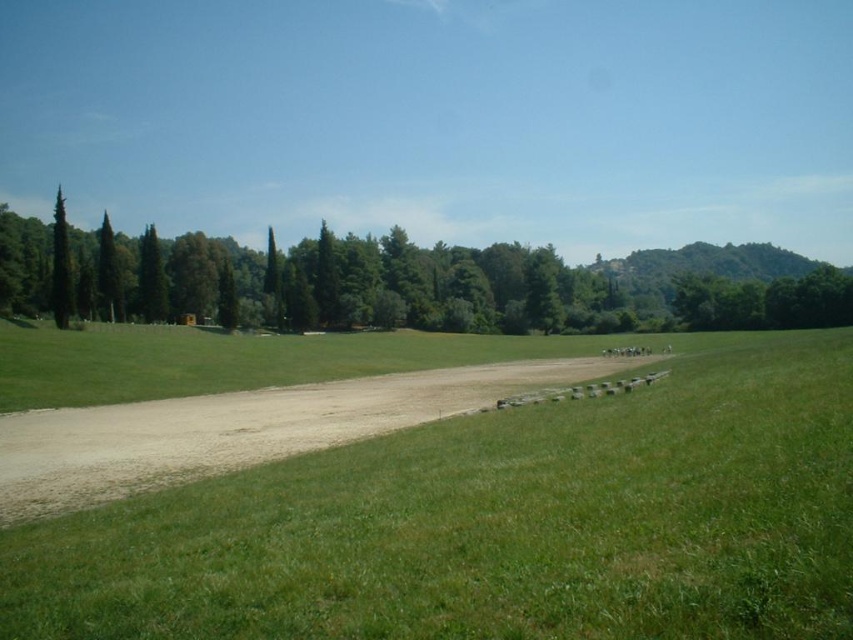
You are standing at the bottom of the slope on the green lawn and want to walk to the dirt path. According to the image, where should you head to reach the brown gravel dirt track at center?

The brown gravel dirt track at center is located at the point with coordinates 0.670 on the x axis and 0.285 on the y axis, so you should head towards that coordinate to reach it.

You are planning to place a large picnic blanket on the brown gravel dirt track at center and the green matte tree at left. Based on their sizes, which location would allow the blanket to fit more comfortably without overlapping the edges?

The green matte tree at left is larger than the brown gravel dirt track at center, so placing the picnic blanket there would provide more space and comfort without overlapping the edges.

You are planning to plant a new tree in this field. The green leafy tree at left is already present. Considering the height of the brown gravel dirt track at center, will the new tree need to be pruned to avoid blocking the view of the track from the tree area?

The green leafy tree at left is taller than the brown gravel dirt track at center, so the new tree might need pruning if it grows to a similar height to ensure the track remains visible.